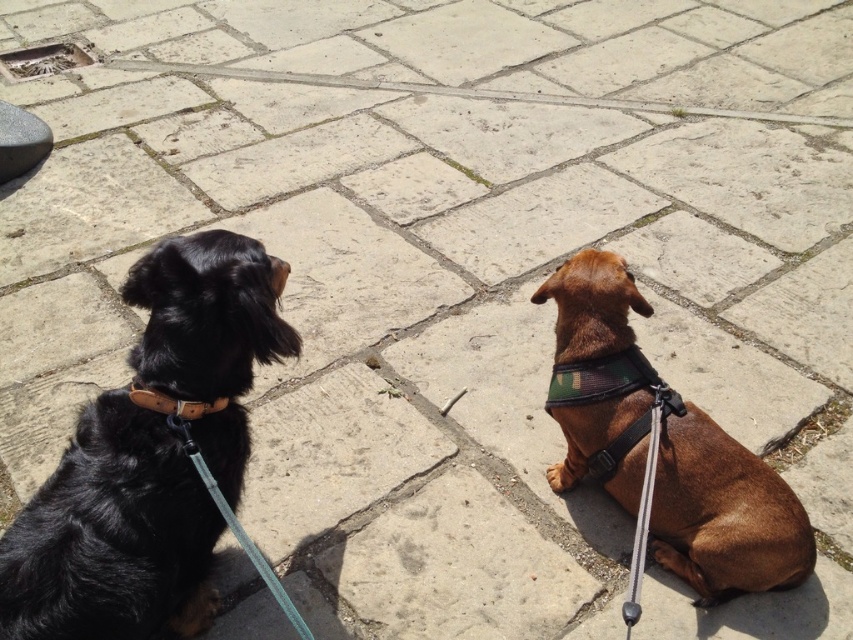
Question: Which object is positioned farthest from the teal fabric leash at lower left?

Choices:
 (A) leather/camel at left
 (B) black leather collar at left
 (C) camouflage fabric neckband at center
 (D) brown matte harness at right

Answer: (D)

Question: Is black leather collar at left thinner than leather/camel at left?

Choices:
 (A) yes
 (B) no

Answer: (B)

Question: Can you confirm if brown matte harness at right is positioned to the right of leather/camel at left?

Choices:
 (A) no
 (B) yes

Answer: (B)

Question: Considering the real-world distances, which object is closest to the teal fabric leash at lower left?

Choices:
 (A) brown matte harness at right
 (B) camouflage fabric neckband at center
 (C) black leather collar at left

Answer: (C)

Question: Which point is closer to the camera?

Choices:
 (A) brown matte harness at right
 (B) leather/camel at left
 (C) black leather collar at left
 (D) camouflage fabric neckband at center

Answer: (C)

Question: Can you confirm if camouflage fabric neckband at center is positioned below teal fabric leash at lower left?

Choices:
 (A) no
 (B) yes

Answer: (A)